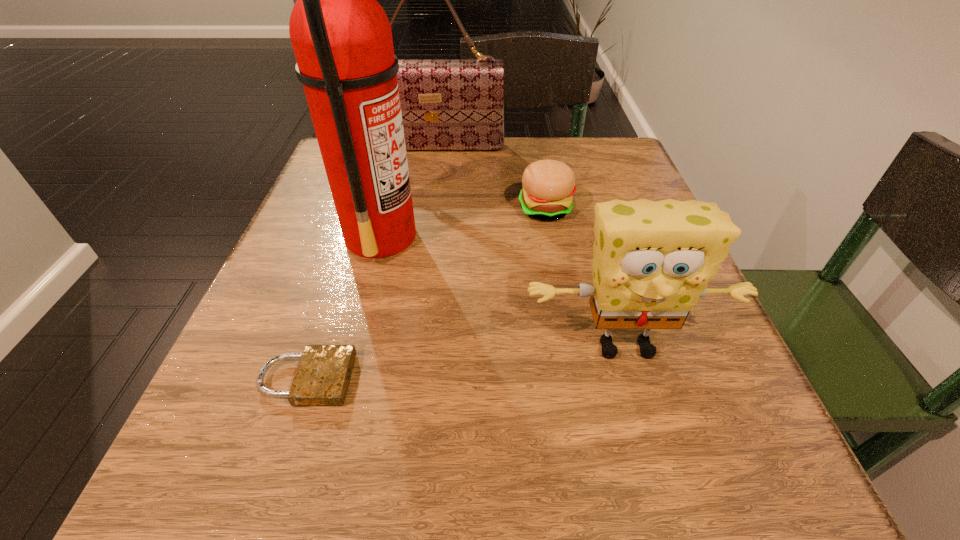
What are the coordinates of `the tallest object` in the screenshot? It's located at (342, 40).

Locate an element on the screen. the farthest object is located at coordinates (446, 104).

Find the location of a particular element. This screenshot has height=540, width=960. the second tallest object is located at coordinates (446, 104).

Locate an element on the screen. sponge is located at coordinates (652, 262).

The image size is (960, 540). What are the coordinates of `the fourth tallest object` in the screenshot? It's located at (548, 185).

Identify the location of padlock. Image resolution: width=960 pixels, height=540 pixels. (322, 378).

The height and width of the screenshot is (540, 960). I want to click on vacant space located 0.240m on the side of the tallest object near the handle, so click(553, 235).

Locate an element on the screen. free space located on the front of the second tallest object with the clasp is located at coordinates (419, 259).

Find the location of a particular element. vacant space located on the face of the sponge is located at coordinates (652, 437).

Where is `free location located on the back of the hamburger`? This screenshot has width=960, height=540. free location located on the back of the hamburger is located at coordinates (538, 164).